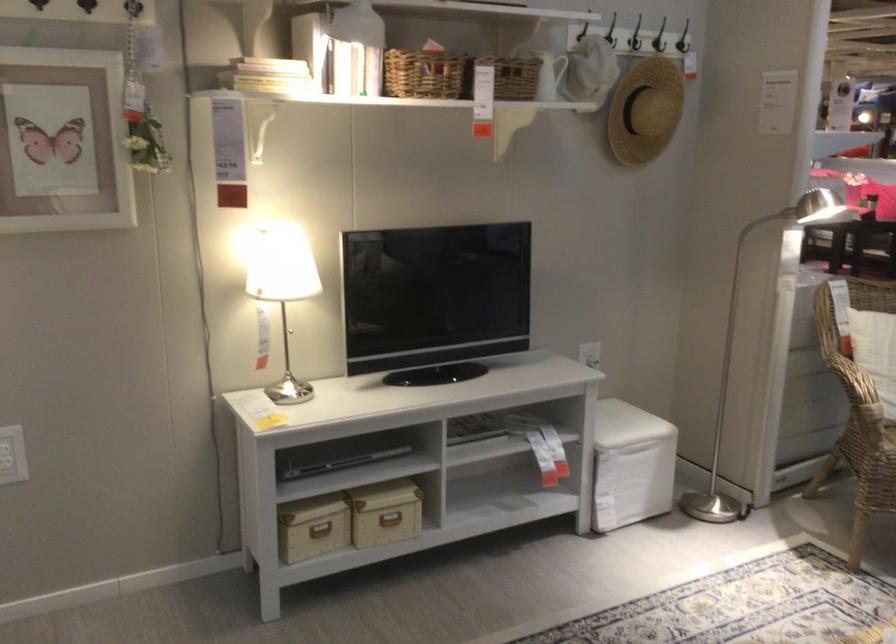
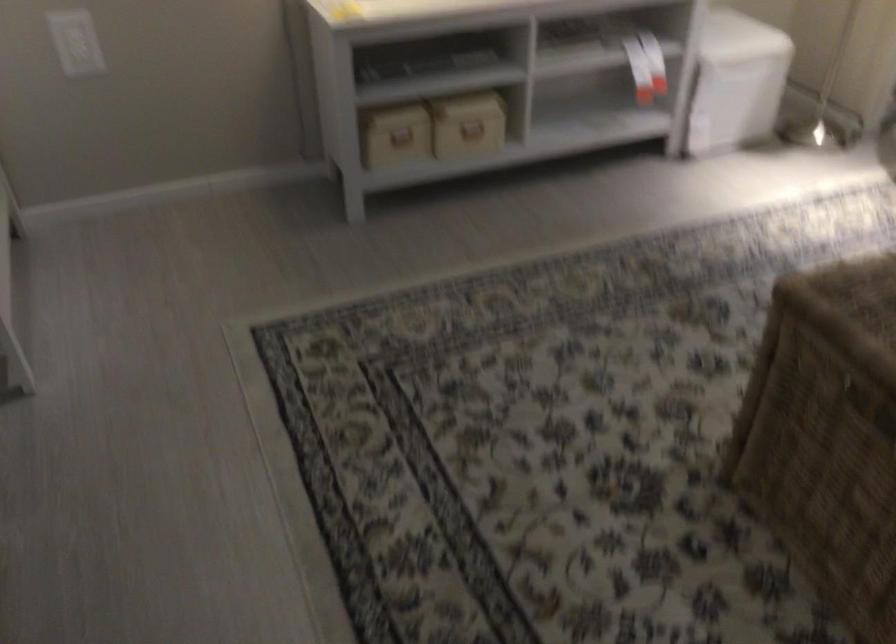
Locate, in the second image, the point that corresponds to point 391,524 in the first image.

(472, 131)